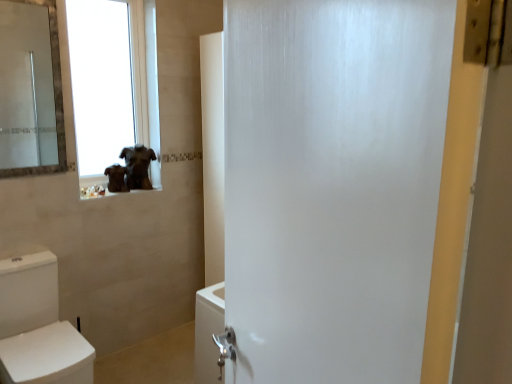
Question: Do you think brown fur dog at upper left, the first animal viewed from the left, is within brown matte statue at upper left, the second animal positioned from the left, or outside of it?

Choices:
 (A) inside
 (B) outside

Answer: (B)

Question: From the image's perspective, is brown fur dog at upper left, the first animal viewed from the left, above or below brown matte statue at upper left, marked as the 1th animal in a right-to-left arrangement?

Choices:
 (A) above
 (B) below

Answer: (B)

Question: Considering the real-world distances, which object is closest to the white glossy toilet at lower left?

Choices:
 (A) brown fur dog at upper left, which is counted as the second animal, starting from the right
 (B) transparent glass window at upper left
 (C) brown matte statue at upper left, marked as the 1th animal in a right-to-left arrangement

Answer: (A)

Question: Which object is positioned farthest from the brown matte statue at upper left, marked as the 1th animal in a right-to-left arrangement?

Choices:
 (A) brown fur dog at upper left, which is counted as the second animal, starting from the right
 (B) white glossy toilet at lower left
 (C) transparent glass window at upper left

Answer: (C)